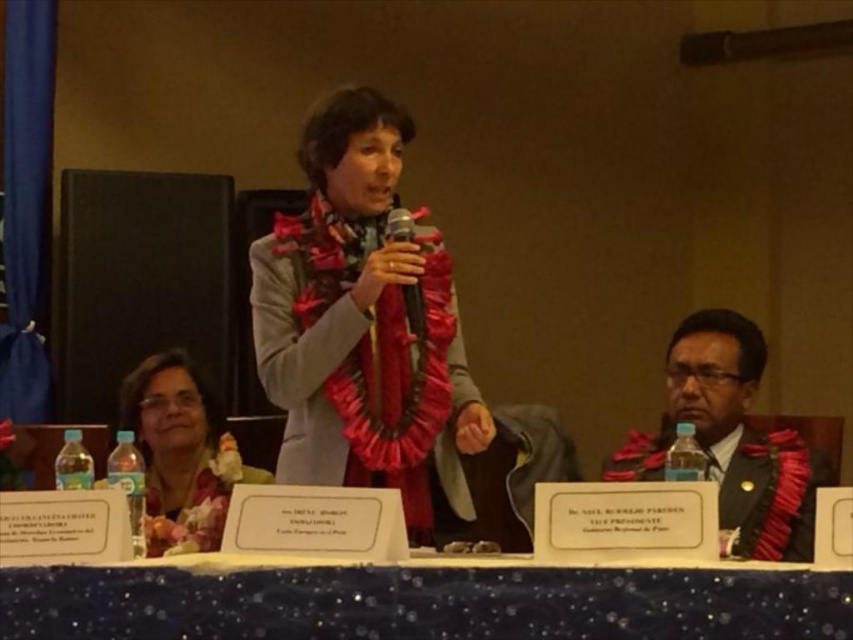
You are standing in the formal event setting described. You need to place a small decorative item on the table that is exactly 6 feet away from the matte black scarf at lower right. Can you place it on the table without moving the scarf?

The distance between the matte black scarf at lower right and the viewer is 5.97 feet, so placing the item 6 feet away from the scarf would require positioning it slightly beyond the current viewer position. However, since the table is part of the scene and the scarf is on it, the table might not extend far enough. Without knowing the table size, it is uncertain if the item can be placed there without moving the scarf.

You are organizing a small event and need to decide whether the blue glitter tablecloth at center can cover the entire area where the matte pink scarf at lower left is placed. Based on the provided information, can the tablecloth cover the scarf?

The blue glitter tablecloth at center might be wider than matte pink scarf at lower left, so there is a possibility that the tablecloth can cover the area where the scarf is placed, but the exact dimensions are uncertain.

You are organizing a presentation and need to place a nameplate between the matte black scarf at lower right and the metallic silver microphone at center. Can the nameplate fit between them if it is narrower than the scarf but wider than the microphone?

The matte black scarf at lower right is wider than the metallic silver microphone at center. Since the nameplate is narrower than the scarf but wider than the microphone, it can fit between them as long as there is enough space between the two objects.